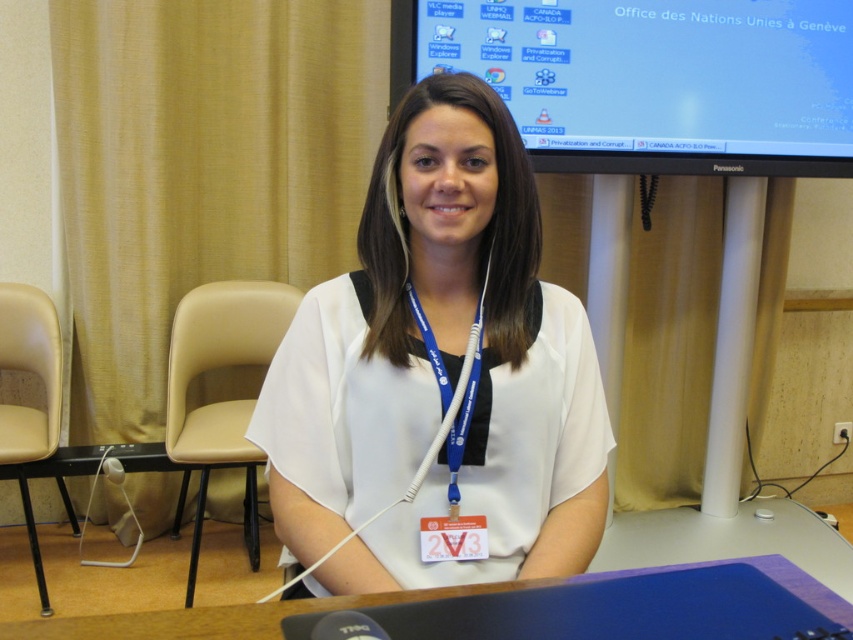
This screenshot has height=640, width=853. I want to click on matte black monitor at upper center, so click(650, 80).

Between matte black monitor at upper center and white plastic table at center, which one has less height?

With less height is white plastic table at center.

Looking at this image, who is more forward, [838,156] or [109,544]?

Point [838,156]

Where is `matte black monitor at upper center`? matte black monitor at upper center is located at coordinates (650, 80).

Does matte black monitor at upper center appear under skinny white neck at center?

No, matte black monitor at upper center is not below skinny white neck at center.

Who is more distant from viewer, (601,26) or (405,248)?

Point (601,26)

At what (x,y) coordinates should I click in order to perform the action: click on matte black monitor at upper center. Please return your answer as a coordinate pair (x, y). This screenshot has height=640, width=853. Looking at the image, I should click on (650, 80).

Who is positioned more to the left, white matte shirt at center or white plastic table at center?

Positioned to the left is white plastic table at center.

Can you confirm if white matte shirt at center is positioned above white plastic table at center?

Correct, white matte shirt at center is located above white plastic table at center.

Is point (376, 250) less distant than point (20, 628)?

That is False.

Image resolution: width=853 pixels, height=640 pixels. What are the coordinates of `white matte shirt at center` in the screenshot? It's located at (438, 376).